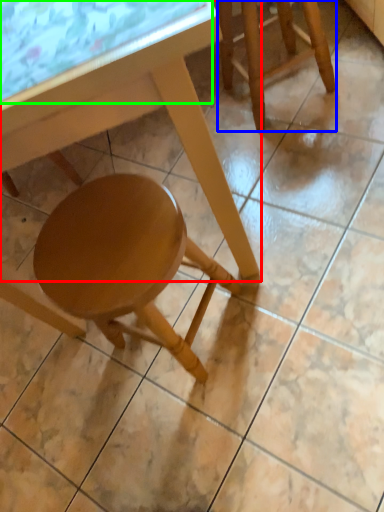
Question: Which object is positioned closest to table (highlighted by a red box)? Select from stool (highlighted by a blue box) and glass table (highlighted by a green box).

Choices:
 (A) stool
 (B) glass table

Answer: (B)